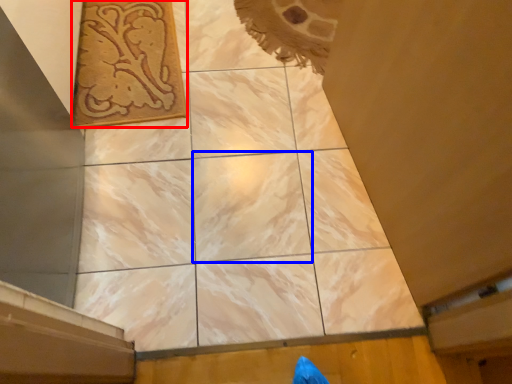
Question: Among these objects, which one is farthest to the camera, design (highlighted by a red box) or tile (highlighted by a blue box)?

Choices:
 (A) design
 (B) tile

Answer: (A)